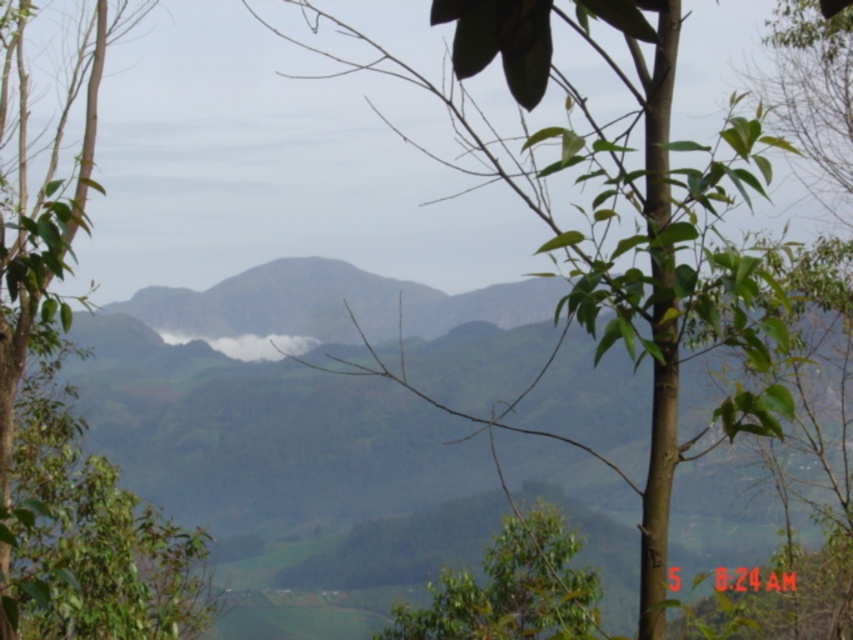
Question: Can you confirm if green leafy tree at center is bigger than green leafy tree at left?

Choices:
 (A) no
 (B) yes

Answer: (B)

Question: Does green leafy tree at center have a greater width compared to white foggy cloud at center?

Choices:
 (A) no
 (B) yes

Answer: (B)

Question: Among these objects, which one is farthest from the camera?

Choices:
 (A) green leafy tree at left
 (B) white foggy cloud at center
 (C) green leafy tree at center

Answer: (B)

Question: Is green leafy tree at center bigger than white foggy cloud at center?

Choices:
 (A) yes
 (B) no

Answer: (A)

Question: Estimate the real-world distances between objects in this image. Which object is farther from the green leafy tree at left?

Choices:
 (A) white foggy cloud at center
 (B) green leafy tree at center

Answer: (A)

Question: Considering the real-world distances, which object is farthest from the green leafy tree at left?

Choices:
 (A) green leafy tree at center
 (B) white foggy cloud at center

Answer: (B)